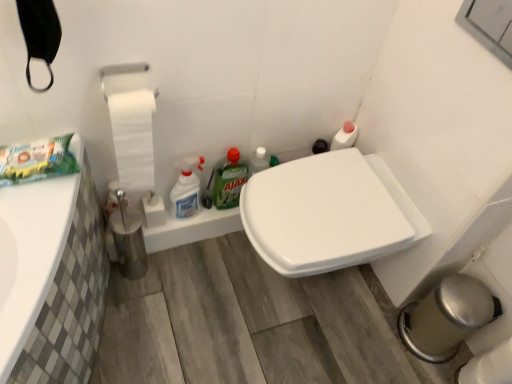
Identify the location of vacant region under white glossy toilet seat at center (from a real-world perspective). This screenshot has width=512, height=384. (298, 291).